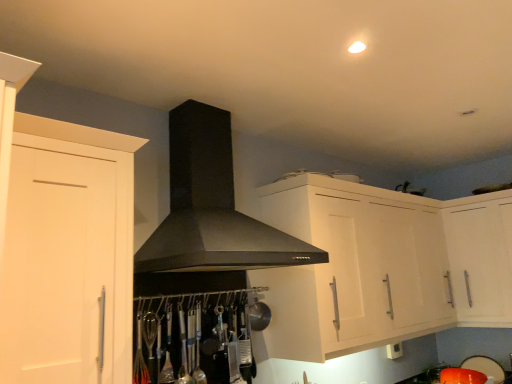
Question: From a real-world perspective, is black matte fume hood at center over white matte cabinet at left, which ranks as the first cabinetry in front-to-back order?

Choices:
 (A) no
 (B) yes

Answer: (B)

Question: Does black matte fume hood at center appear on the right side of white matte cabinet at left, which is the second cabinetry from back to front?

Choices:
 (A) no
 (B) yes

Answer: (B)

Question: Is black matte fume hood at center shorter than white matte cabinet at left, which ranks as the first cabinetry in front-to-back order?

Choices:
 (A) yes
 (B) no

Answer: (A)

Question: Is white matte cabinet at left, which is the second cabinetry from back to front, completely or partially inside black matte fume hood at center?

Choices:
 (A) yes
 (B) no

Answer: (B)

Question: Would you say black matte fume hood at center is outside white matte cabinet at left, which is the second cabinetry from back to front?

Choices:
 (A) yes
 (B) no

Answer: (A)

Question: From the image's perspective, is black matte fume hood at center on white matte cabinet at left, which ranks as the 2th cabinetry in right-to-left order?

Choices:
 (A) no
 (B) yes

Answer: (B)

Question: From a real-world perspective, is black matte fume hood at center physically above white glossy cabinet at upper right, the 2th cabinetry in the left-to-right sequence?

Choices:
 (A) yes
 (B) no

Answer: (A)

Question: From a real-world perspective, is black matte fume hood at center under white glossy cabinet at upper right, which is the first cabinetry in back-to-front order?

Choices:
 (A) no
 (B) yes

Answer: (A)

Question: Is black matte fume hood at center at the left side of white glossy cabinet at upper right, the second cabinetry when ordered from front to back?

Choices:
 (A) no
 (B) yes

Answer: (B)

Question: From the image's perspective, is black matte fume hood at center below white glossy cabinet at upper right, the 2th cabinetry in the left-to-right sequence?

Choices:
 (A) no
 (B) yes

Answer: (A)

Question: Is black matte fume hood at center positioned in front of white glossy cabinet at upper right, the 2th cabinetry in the left-to-right sequence?

Choices:
 (A) yes
 (B) no

Answer: (A)

Question: Is black matte fume hood at center thinner than white glossy cabinet at upper right, which is the first cabinetry in back-to-front order?

Choices:
 (A) yes
 (B) no

Answer: (B)

Question: Considering the relative positions of white glossy cabinet at upper right, the second cabinetry when ordered from front to back, and black matte fume hood at center in the image provided, is white glossy cabinet at upper right, the second cabinetry when ordered from front to back, to the right of black matte fume hood at center from the viewer's perspective?

Choices:
 (A) yes
 (B) no

Answer: (A)